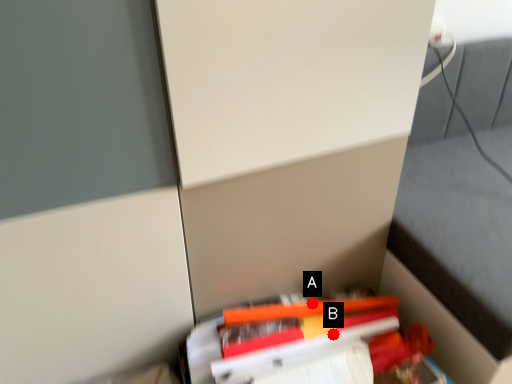
Question: Two points are circled on the image, labeled by A and B beside each circle. Which point appears farthest from the camera in this image?

Choices:
 (A) A is further
 (B) B is further

Answer: (A)